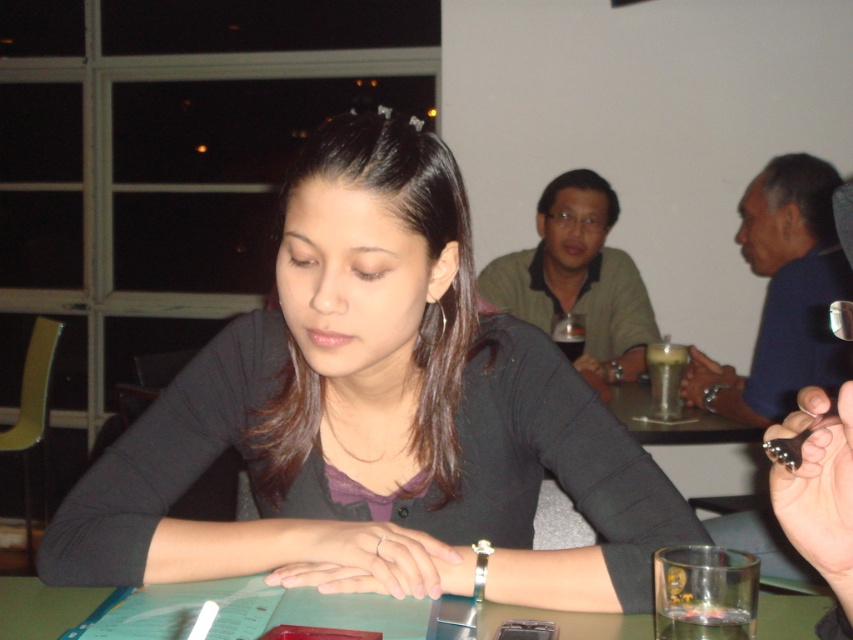
What are the coordinates of the matte black shirt at center?

The matte black shirt at center is located at point (x=376, y=417).